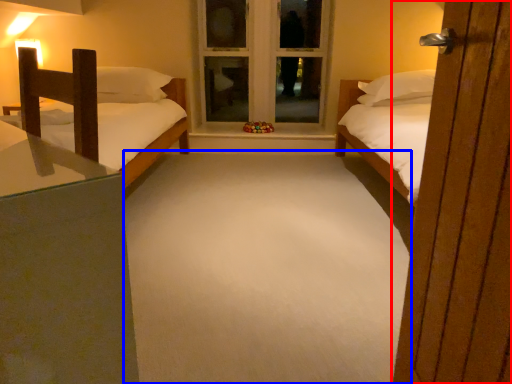
Question: Which of the following is the farthest to the observer, door (highlighted by a red box) or plain (highlighted by a blue box)?

Choices:
 (A) door
 (B) plain

Answer: (B)